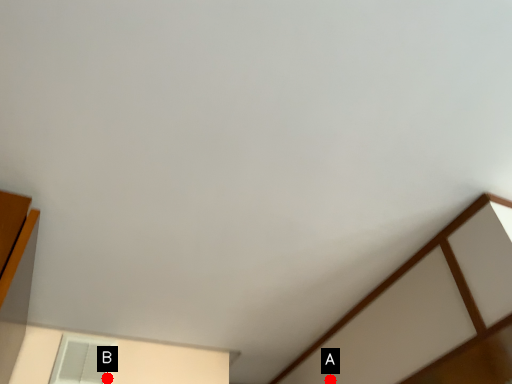
Question: Two points are circled on the image, labeled by A and B beside each circle. Which point is further to the camera?

Choices:
 (A) A is further
 (B) B is further

Answer: (A)